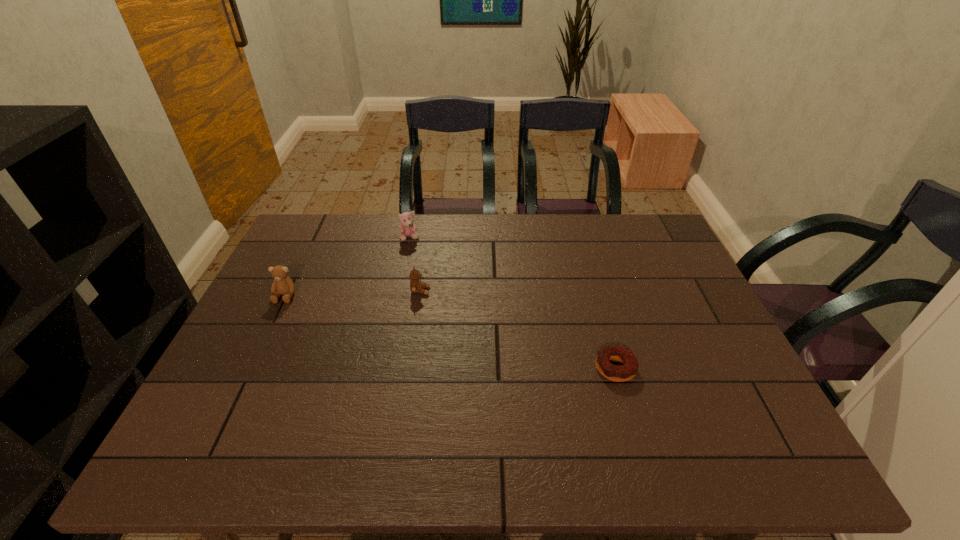
Select which object appears as the closest to the second teddy bear from right to left. Please provide its 2D coordinates. Your answer should be formatted as a tuple, i.e. [(x, y)], where the tuple contains the x and y coordinates of a point satisfying the conditions above.

[(416, 286)]

Choose which teddy bear is the third nearest neighbor to the shortest object. Please provide its 2D coordinates. Your answer should be formatted as a tuple, i.e. [(x, y)], where the tuple contains the x and y coordinates of a point satisfying the conditions above.

[(282, 285)]

Find the location of a particular element. The height and width of the screenshot is (540, 960). the closest teddy bear to the leftmost object is located at coordinates (416, 286).

This screenshot has height=540, width=960. I want to click on vacant space that satisfies the following two spatial constraints: 1. on the front-facing side of the second object from right to left; 2. on the front-facing side of the leftmost teddy bear, so click(420, 295).

Locate an element on the screen. The width and height of the screenshot is (960, 540). blank area in the image that satisfies the following two spatial constraints: 1. at the face of the shortest object; 2. on the right side of the second teddy bear from right to left is located at coordinates (384, 368).

This screenshot has height=540, width=960. Find the location of `vacant position in the image that satisfies the following two spatial constraints: 1. on the front-facing side of the nearest object; 2. on the right side of the shortest teddy bear`. vacant position in the image that satisfies the following two spatial constraints: 1. on the front-facing side of the nearest object; 2. on the right side of the shortest teddy bear is located at coordinates (409, 368).

This screenshot has width=960, height=540. Find the location of `blank area in the image that satisfies the following two spatial constraints: 1. on the front-facing side of the leftmost object; 2. on the right side of the doughnut`. blank area in the image that satisfies the following two spatial constraints: 1. on the front-facing side of the leftmost object; 2. on the right side of the doughnut is located at coordinates (251, 368).

The width and height of the screenshot is (960, 540). I want to click on vacant space that satisfies the following two spatial constraints: 1. at the face of the third object from right to left; 2. on the left side of the shortest object, so click(x=384, y=368).

What are the coordinates of `vacant region that satisfies the following two spatial constraints: 1. on the front-facing side of the second object from right to left; 2. on the right side of the doughnut` in the screenshot? It's located at (409, 368).